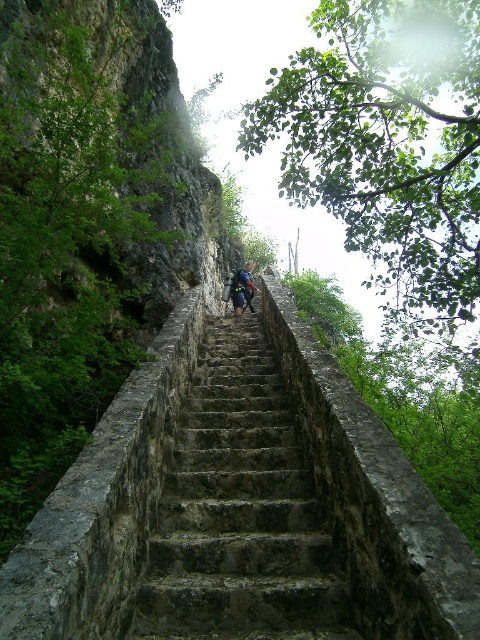
You are standing at the base of the steep stone staircase leading up the cliffside. You notice two points marked on the staircase. One is at coordinate point (x=310, y=481) and the other at point (x=240, y=308). Which of these two points is closer to your current position?

Point (x=310, y=481) is closer to the camera than point (x=240, y=308), so the point at (x=310, y=481) is closer to your current position.

You are a hiker carrying a blue fabric backpack at center and need to climb the rusty stone staircase at center. Which side of the staircase should you walk on to avoid the backpack hitting the cliffside vegetation?

The rusty stone staircase at center is positioned on the left side of blue fabric backpack at center. Therefore, you should walk on the right side of the staircase to keep the backpack away from the cliffside vegetation on the left side.

You are standing at the base of the rusty stone staircase at center and want to place your blue fabric backpack at center on the first step. Can you safely put it there?

The rusty stone staircase at center is closer to the viewer than the blue fabric backpack at center, so the backpack is further away. Therefore, you cannot place it on the first step because it is not within reach.